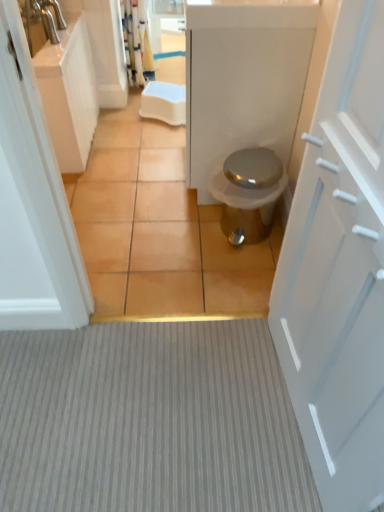
Question: From the image's perspective, is white matte door at right above or below brown tile at center?

Choices:
 (A) below
 (B) above

Answer: (A)

Question: Based on their sizes in the image, would you say white matte door at right is bigger or smaller than brown tile at center?

Choices:
 (A) small
 (B) big

Answer: (B)

Question: Which object is positioned closest to the white glossy cabinet at left?

Choices:
 (A) white matte door at right
 (B) white glossy counter top at upper center
 (C) brown tile at center
 (D) gray textured carpet at center
 (E) metallic silver trash can at center

Answer: (C)

Question: Which object is positioned closest to the brown tile at center?

Choices:
 (A) white glossy counter top at upper center
 (B) white glossy cabinet at left
 (C) metallic silver trash can at center
 (D) gray textured carpet at center
 (E) white matte door at right

Answer: (B)